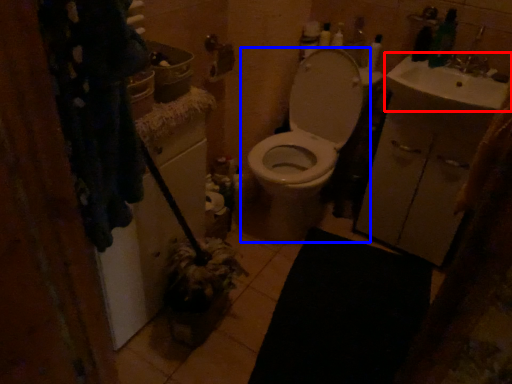
Question: Which object is further to the camera taking this photo, sink (highlighted by a red box) or toilet (highlighted by a blue box)?

Choices:
 (A) sink
 (B) toilet

Answer: (B)